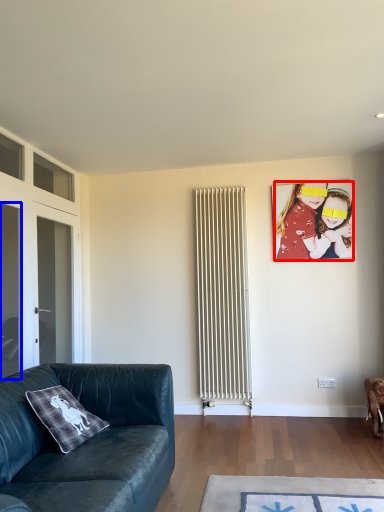
Question: Which point is further to the camera, person (highlighted by a red box) or glass door (highlighted by a blue box)?

Choices:
 (A) person
 (B) glass door

Answer: (A)